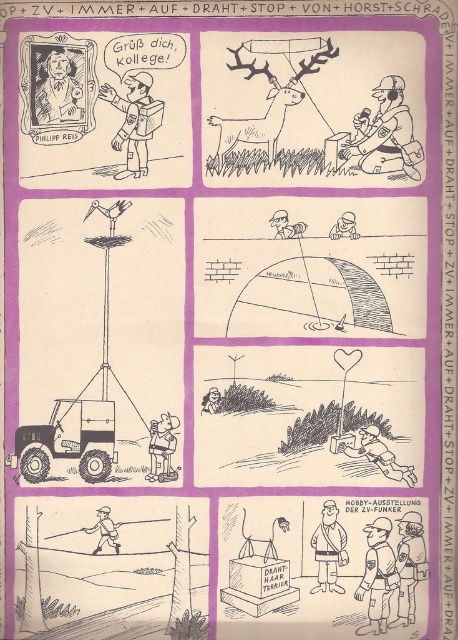
In the comic strip described, there are two elements to notice. The first is a smooth skin portrait at upper left, and the second is a light brown uniform at lower right. From the perspective of someone reading the comic from left to right, which element would they encounter first?

The smooth skin portrait at upper left is to the left of the light brown uniform at lower right, so readers would encounter the smooth skin portrait at upper left first when reading from left to right.

In the comic strip, where is the matte black astronaut at upper left located in terms of coordinates?

The matte black astronaut at upper left is located at point coordinates of (135, 120).

Based on the comic strip scene, which object is thinner between the uniformed person at lower right and the smooth skin portrait at upper left?

The uniformed person at lower right is thinner than the smooth skin portrait at upper left.